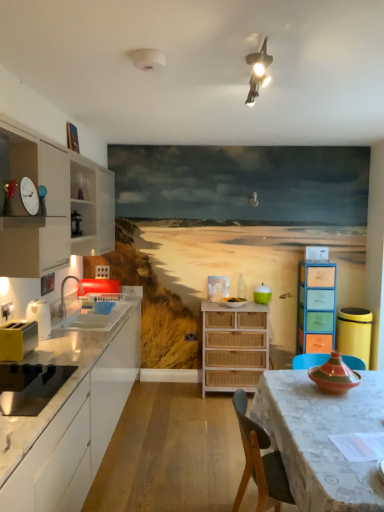
Question: Is woven wood chest of drawers at center, placed as the first chest of drawers when sorted from left to right, taller or shorter than white glossy countertop at left, which ranks as the second cabinetry in top-to-bottom order?

Choices:
 (A) short
 (B) tall

Answer: (A)

Question: Is point (225, 340) closer or farther from the camera than point (92, 386)?

Choices:
 (A) farther
 (B) closer

Answer: (A)

Question: Which object is positioned farthest from the matte wooden drawer at center, the fourth appliance in the bottom-to-top sequence?

Choices:
 (A) multicolored plastic chest of drawers at right, arranged as the 2th chest of drawers when viewed from the left
 (B) white glossy sink at left
 (C) green matte jar at center, which is the 3th appliance in right-to-left order
 (D) yellow plastic toaster at left
 (E) multicolored ceramic vase at table, the 6th appliance from the left

Answer: (D)

Question: Based on their relative distances, which object is farther from the multicolored ceramic vase at table, the 6th appliance from the left?

Choices:
 (A) white glossy countertop at left, which ranks as the second cabinetry in top-to-bottom order
 (B) white glossy toaster at left, the third appliance from the top
 (C) matte wooden drawer at center, positioned as the sixth appliance in front-to-back order
 (D) multicolored plastic chest of drawers at right, the 1th chest of drawers when ordered from right to left
 (E) metallic silver water filter at upper left, the 7th appliance positioned from the bottom

Answer: (E)